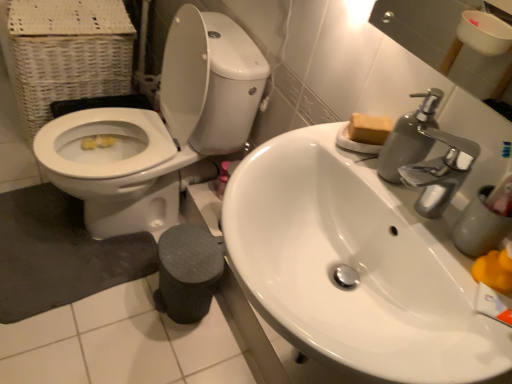
Find the location of a particular element. Image resolution: width=512 pixels, height=384 pixels. vacant space that is to the left of silver metallic faucet at upper right is located at coordinates (331, 154).